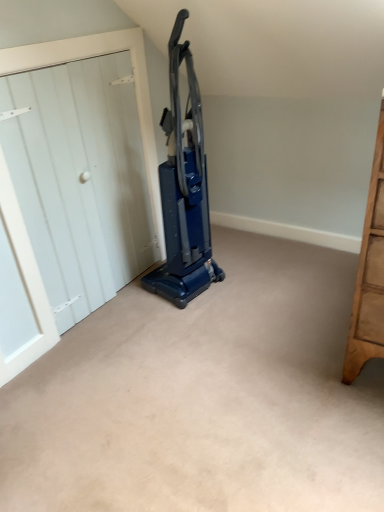
The height and width of the screenshot is (512, 384). I want to click on vacant space to the right of blue plastic vacuum cleaner at center, so click(248, 280).